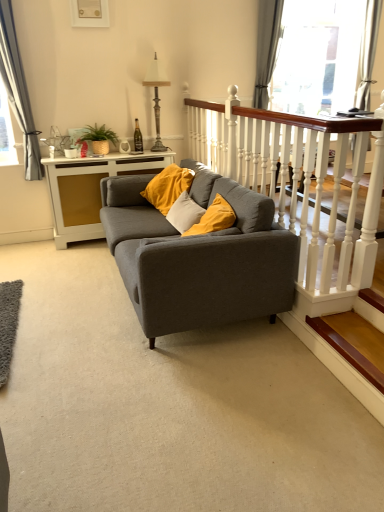
Question: Should I look upward or downward to see gray fabric curtain at upper right, the 2th curtain positioned from the left?

Choices:
 (A) down
 (B) up

Answer: (B)

Question: Is matte gray couch at center facing away from wooden at lower right?

Choices:
 (A) no
 (B) yes

Answer: (A)

Question: From a real-world perspective, is matte gray couch at center below wooden at lower right?

Choices:
 (A) yes
 (B) no

Answer: (B)

Question: Considering the relative positions of matte gray couch at center and wooden at lower right in the image provided, is matte gray couch at center in front of wooden at lower right?

Choices:
 (A) no
 (B) yes

Answer: (A)

Question: Is matte gray couch at center oriented towards wooden at lower right?

Choices:
 (A) no
 (B) yes

Answer: (A)

Question: From the image's perspective, is matte gray couch at center above wooden at lower right?

Choices:
 (A) no
 (B) yes

Answer: (B)

Question: Can you confirm if matte gray couch at center is wider than wooden at lower right?

Choices:
 (A) no
 (B) yes

Answer: (B)

Question: Can you confirm if transparent glass door at upper center is thinner than matte gray couch at center?

Choices:
 (A) yes
 (B) no

Answer: (A)

Question: Is transparent glass door at upper center facing towards matte gray couch at center?

Choices:
 (A) yes
 (B) no

Answer: (B)

Question: Is transparent glass door at upper center bigger than matte gray couch at center?

Choices:
 (A) no
 (B) yes

Answer: (A)

Question: From the image's perspective, does transparent glass door at upper center appear lower than matte gray couch at center?

Choices:
 (A) yes
 (B) no

Answer: (B)

Question: Is transparent glass door at upper center at the right side of matte gray couch at center?

Choices:
 (A) yes
 (B) no

Answer: (A)

Question: Considering the relative sizes of transparent glass door at upper center and matte gray couch at center in the image provided, is transparent glass door at upper center wider than matte gray couch at center?

Choices:
 (A) yes
 (B) no

Answer: (B)

Question: Considering the relative sizes of wooden at lower right and matte gray couch at center in the image provided, is wooden at lower right bigger than matte gray couch at center?

Choices:
 (A) no
 (B) yes

Answer: (A)